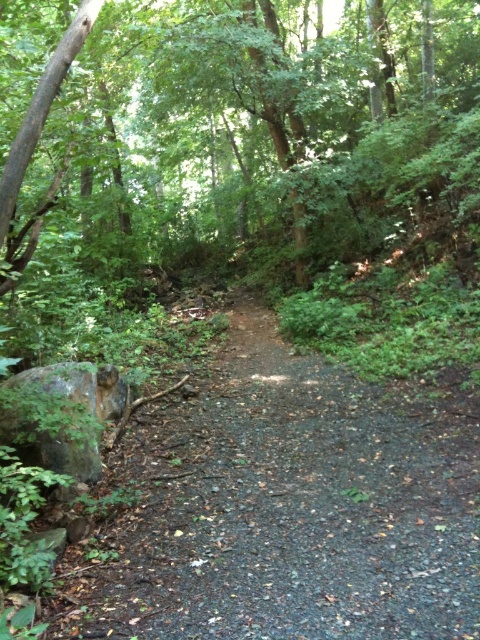
Question: Among these points, which one is nearest to the camera?

Choices:
 (A) (233, 371)
 (B) (55, 369)

Answer: (B)

Question: Does dirt path at center appear over rusty metallic rock at left?

Choices:
 (A) no
 (B) yes

Answer: (A)

Question: Which object is farther from the camera taking this photo?

Choices:
 (A) dirt path at center
 (B) rusty metallic rock at left

Answer: (B)

Question: Which point is closer to the camera?

Choices:
 (A) rusty metallic rock at left
 (B) dirt path at center

Answer: (B)

Question: Is dirt path at center to the right of rusty metallic rock at left from the viewer's perspective?

Choices:
 (A) no
 (B) yes

Answer: (B)

Question: Is the position of dirt path at center more distant than that of rusty metallic rock at left?

Choices:
 (A) yes
 (B) no

Answer: (B)